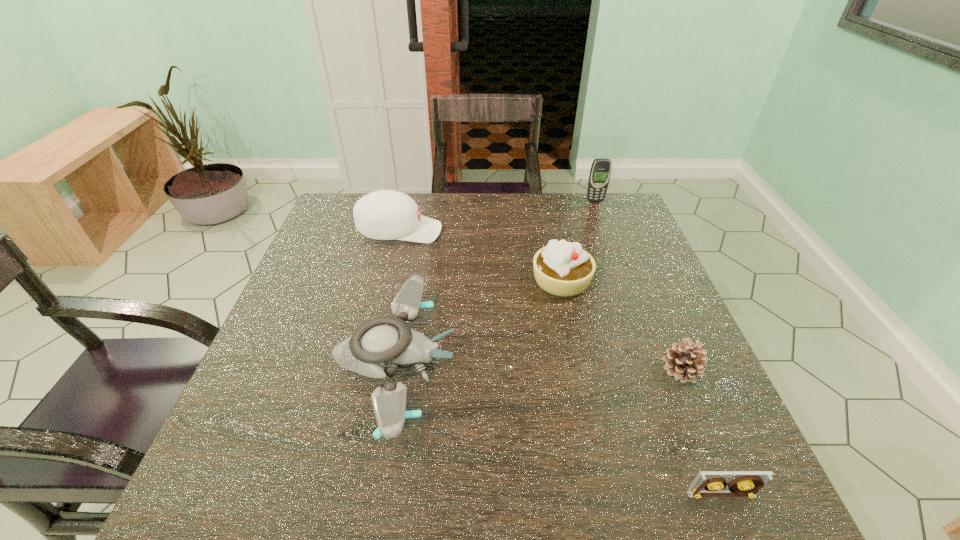
Where is `free space located on the back of the pinecone`? The image size is (960, 540). free space located on the back of the pinecone is located at coordinates [635, 261].

Find the location of a particular element. Image resolution: width=960 pixels, height=540 pixels. blank space located on the front-facing side of the drone is located at coordinates (550, 362).

I want to click on cellular telephone that is at the far edge, so click(600, 171).

You are a GUI agent. You are given a task and a screenshot of the screen. Output one action in this format:
    pyautogui.click(x=<x>, y=<y>)
    Task: Click on the baseball cap that is at the far edge
    
    Given the screenshot: What is the action you would take?
    pyautogui.click(x=386, y=214)

What are the coordinates of `object positioned at the near edge` in the screenshot? It's located at (745, 483).

This screenshot has height=540, width=960. Identify the location of object that is at the left edge. (386, 214).

Locate an element on the screen. cellular telephone positioned at the right edge is located at coordinates (600, 171).

Find the location of a particular element. The width and height of the screenshot is (960, 540). pinecone located at the right edge is located at coordinates (684, 361).

The image size is (960, 540). I want to click on videotape that is at the right edge, so click(745, 483).

Find the location of a particular element. Image resolution: width=960 pixels, height=540 pixels. object situated at the far left corner is located at coordinates (386, 214).